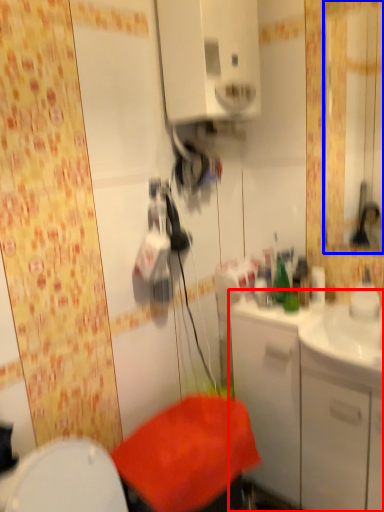
Question: Which object appears closest to the camera in this image, bathroom cabinet (highlighted by a red box) or mirror (highlighted by a blue box)?

Choices:
 (A) bathroom cabinet
 (B) mirror

Answer: (A)